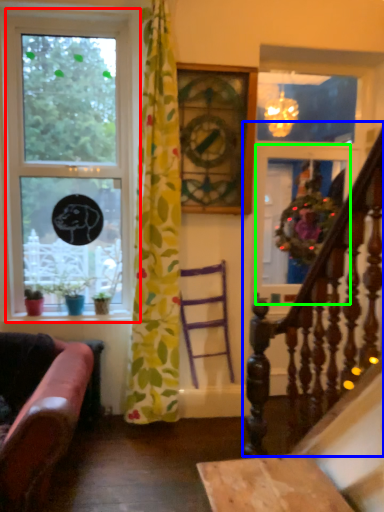
Question: Which object is the closest to the window (highlighted by a red box)? Choose among these: rail (highlighted by a blue box) or glass door (highlighted by a green box).

Choices:
 (A) rail
 (B) glass door

Answer: (B)